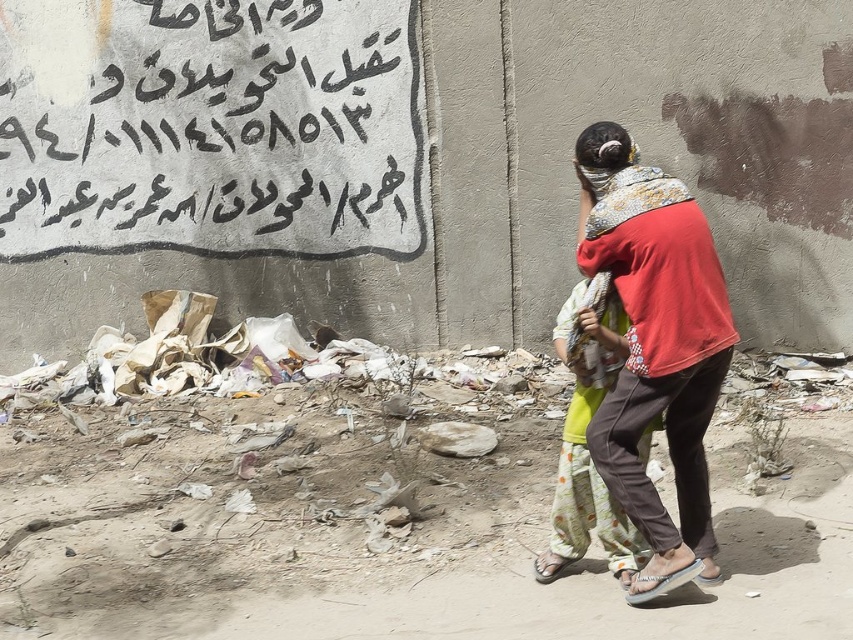
Question: Which point is farther to the camera?

Choices:
 (A) red cotton shirt at center
 (B) black painted text at upper left

Answer: (B)

Question: In this image, where is black painted text at upper left located relative to red cotton shirt at center?

Choices:
 (A) above
 (B) below

Answer: (A)

Question: Which of the following is the closest to the observer?

Choices:
 (A) (393, 248)
 (B) (706, 544)

Answer: (B)

Question: Which point appears farthest from the camera in this image?

Choices:
 (A) (39, 189)
 (B) (618, 429)

Answer: (A)

Question: From the image, what is the correct spatial relationship of black painted text at upper left in relation to red cotton shirt at center?

Choices:
 (A) above
 (B) below

Answer: (A)

Question: Can you confirm if black painted text at upper left is bigger than red cotton shirt at center?

Choices:
 (A) no
 (B) yes

Answer: (B)